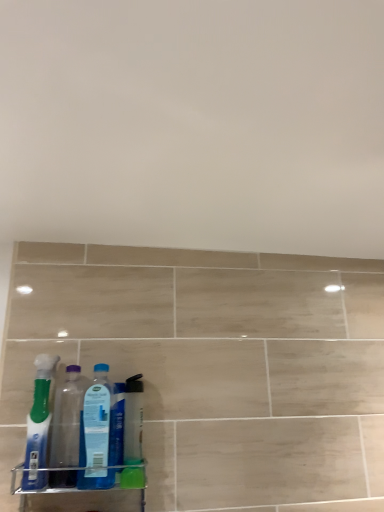
Question: From a real-world perspective, is translucent blue toothbrush at left, the 3th bottle from the right, positioned above or below transparent plastic bottle at left, the 2th bottle positioned from the left?

Choices:
 (A) above
 (B) below

Answer: (A)

Question: From the image's perspective, is translucent blue toothbrush at left, the 3th bottle from the right, above or below transparent plastic bottle at left, the 2th bottle positioned from the left?

Choices:
 (A) below
 (B) above

Answer: (B)

Question: Considering the real-world distances, which object is farthest from the blue translucent bottle at center, the 3th bottle in the left-to-right sequence?

Choices:
 (A) translucent blue toothbrush at left, marked as the 1th bottle in a left-to-right arrangement
 (B) transparent plastic bottle at left, the 2th bottle when ordered from right to left
 (C) clear plastic spray bottle at center

Answer: (A)

Question: Which object is the farthest from the clear plastic spray bottle at center?

Choices:
 (A) translucent blue toothbrush at left, the 3th bottle from the right
 (B) transparent plastic bottle at left, the 2th bottle when ordered from right to left
 (C) blue translucent bottle at center, the 3th bottle in the left-to-right sequence

Answer: (A)